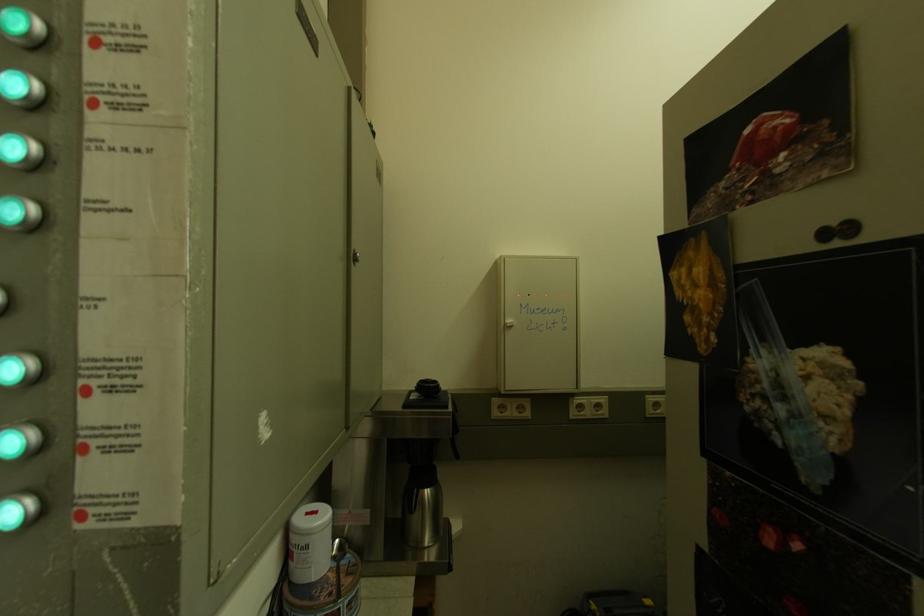
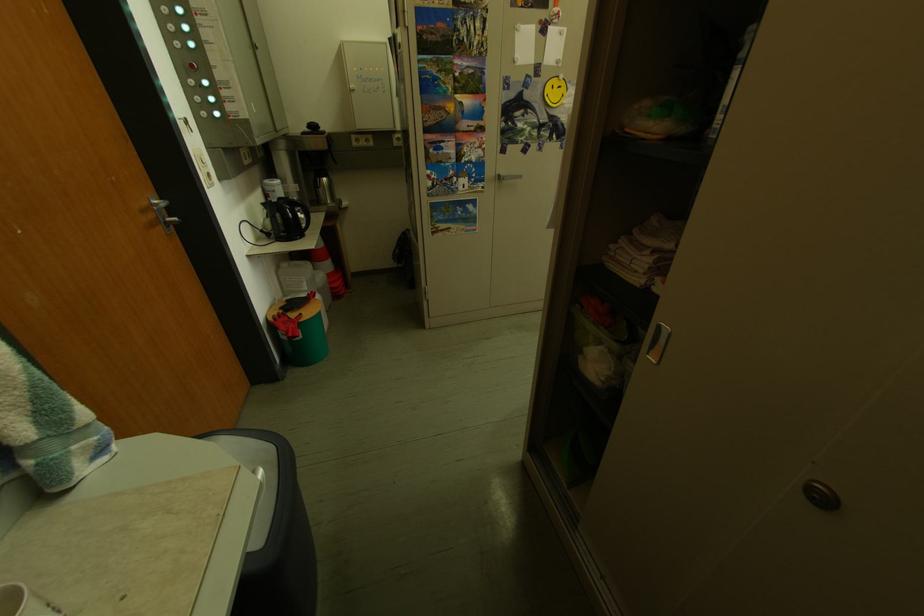
Locate, in the second image, the point that corresponds to point 524,330 in the first image.

(367, 92)